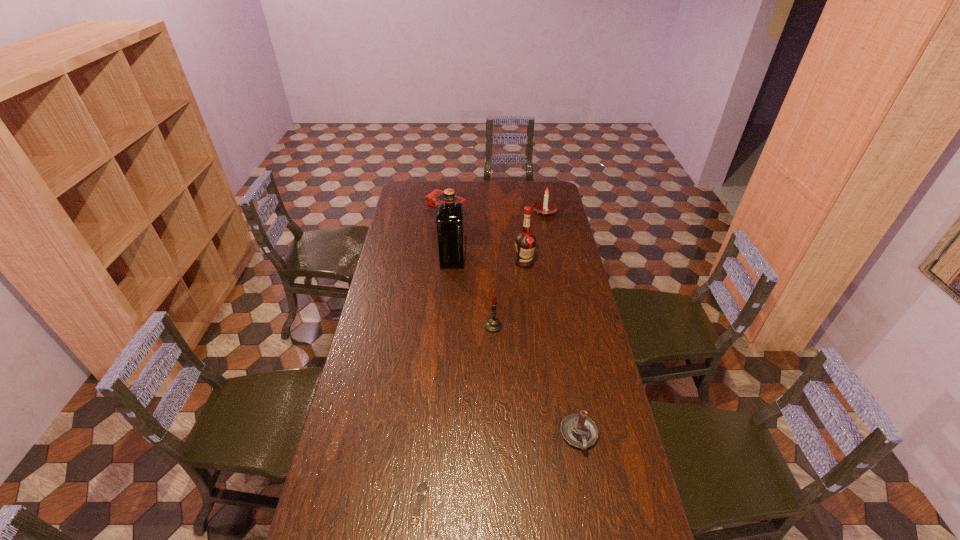
This screenshot has height=540, width=960. I want to click on the nearest object, so click(422, 487).

Identify the location of watch. The image size is (960, 540). [x=422, y=487].

You are a GUI agent. You are given a task and a screenshot of the screen. Output one action in this format:
    pyautogui.click(x=<x>, y=<y>)
    Task: Click on the vacant region located on the front label of the left liquor
    The image size is (960, 540).
    Given the screenshot: What is the action you would take?
    pyautogui.click(x=506, y=259)

Locate an element on the screen. The height and width of the screenshot is (540, 960). blank space located on the front and back of the right liquor is located at coordinates (527, 289).

Locate an element on the screen. This screenshot has height=540, width=960. vacant space located on the back of the second farthest candle is located at coordinates (492, 270).

Where is `blank area located on the front of the farthest candle`? The image size is (960, 540). blank area located on the front of the farthest candle is located at coordinates (549, 233).

You are a GUI agent. You are given a task and a screenshot of the screen. Output one action in this format:
    pyautogui.click(x=<x>, y=<y>)
    Task: Click on the vacant space located 0.100m on the front of the camera
    The image size is (960, 540).
    Given the screenshot: What is the action you would take?
    pos(444,242)

The image size is (960, 540). What are the coordinates of `vacant area situated 0.210m on the side of the second shortest object with the handle loop` in the screenshot? It's located at (596, 528).

Where is `vacant region located 0.060m on the right of the shortest object`? This screenshot has height=540, width=960. vacant region located 0.060m on the right of the shortest object is located at coordinates (447, 503).

Locate an element on the screen. The image size is (960, 540). blank space at the far edge is located at coordinates (473, 190).